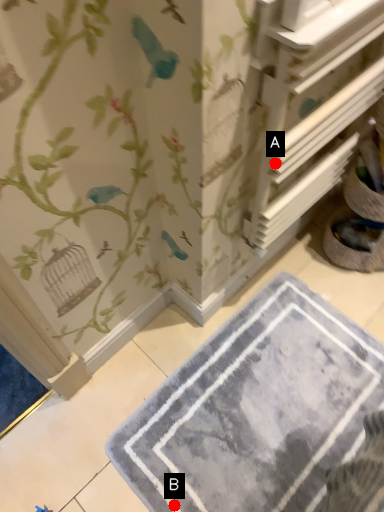
Question: Two points are circled on the image, labeled by A and B beside each circle. Which point is further to the camera?

Choices:
 (A) A is further
 (B) B is further

Answer: (B)